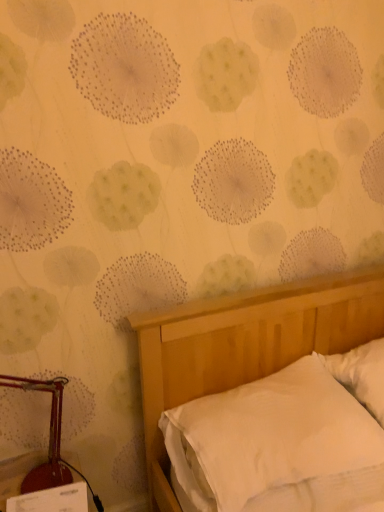
Question: Does metallic red lamp at left come behind white soft pillow at right?

Choices:
 (A) yes
 (B) no

Answer: (B)

Question: Is metallic red lamp at left turned away from white soft pillow at right?

Choices:
 (A) yes
 (B) no

Answer: (B)

Question: Can you confirm if metallic red lamp at left is shorter than white soft pillow at right?

Choices:
 (A) no
 (B) yes

Answer: (A)

Question: From a real-world perspective, is metallic red lamp at left located beneath white soft pillow at right?

Choices:
 (A) no
 (B) yes

Answer: (A)

Question: Is metallic red lamp at left wider than white soft pillow at right?

Choices:
 (A) no
 (B) yes

Answer: (A)

Question: Considering the relative sizes of metallic red lamp at left and white soft pillow at right in the image provided, is metallic red lamp at left taller than white soft pillow at right?

Choices:
 (A) no
 (B) yes

Answer: (B)

Question: Is the position of white soft pillow at right more distant than that of metallic red lamp at left?

Choices:
 (A) yes
 (B) no

Answer: (A)

Question: Is white soft pillow at right at the left side of metallic red lamp at left?

Choices:
 (A) yes
 (B) no

Answer: (B)

Question: From the image's perspective, is white soft pillow at right over metallic red lamp at left?

Choices:
 (A) no
 (B) yes

Answer: (B)

Question: Is metallic red lamp at left a part of white soft pillow at right?

Choices:
 (A) yes
 (B) no

Answer: (B)

Question: Considering the relative sizes of white soft pillow at right and metallic red lamp at left in the image provided, is white soft pillow at right taller than metallic red lamp at left?

Choices:
 (A) yes
 (B) no

Answer: (B)

Question: Are white soft pillow at right and metallic red lamp at left far apart?

Choices:
 (A) no
 (B) yes

Answer: (B)

Question: Is white smooth bed at lower right next to white soft pillow at right?

Choices:
 (A) yes
 (B) no

Answer: (B)